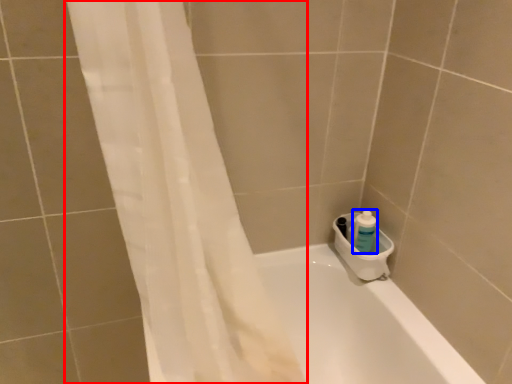
Question: Which point is closer to the camera, shower curtain (highlighted by a red box) or cleaning product (highlighted by a blue box)?

Choices:
 (A) shower curtain
 (B) cleaning product

Answer: (A)